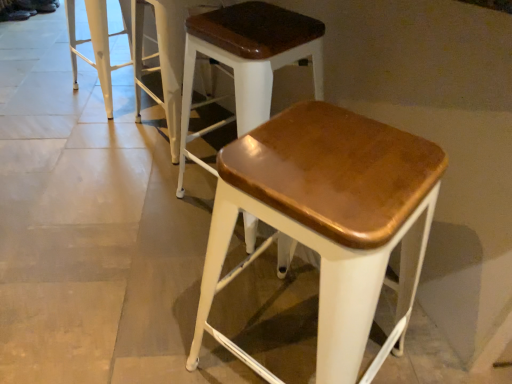
The image size is (512, 384). In order to click on white metal stool at upper left, which is the first stool in left-to-right order in this screenshot , I will do `click(98, 43)`.

This screenshot has width=512, height=384. What do you see at coordinates (98, 43) in the screenshot?
I see `white metal stool at upper left, which is the first stool in left-to-right order` at bounding box center [98, 43].

Locate an element on the screen. matte brown wood stool at center, the 3th stool positioned from the left is located at coordinates (248, 61).

Identify the location of matte brown wood stool at center, marked as the 1th stool in a right-to-left arrangement. This screenshot has width=512, height=384. (329, 221).

Identify the location of the 3rd stool above the white metal stool at upper left, which is counted as the 4th stool, starting from the right (from a real-world perspective). (329, 221).

Does matte brown wood stool at center, which ranks as the 4th stool in left-to-right order, have a lesser height compared to white metal stool at upper left, which is the first stool in left-to-right order?

No.

Considering their positions, is matte brown wood stool at center, marked as the 1th stool in a right-to-left arrangement, located in front of or behind white metal stool at upper left, which is the first stool in left-to-right order?

matte brown wood stool at center, marked as the 1th stool in a right-to-left arrangement, is positioned closer to the viewer than white metal stool at upper left, which is the first stool in left-to-right order.

Is matte brown wood stool at center, marked as the 1th stool in a right-to-left arrangement, with white metal stool at upper left, which is the first stool in left-to-right order?

No, matte brown wood stool at center, marked as the 1th stool in a right-to-left arrangement, is not in contact with white metal stool at upper left, which is the first stool in left-to-right order.

Who is smaller, white metal stool at upper left, which is counted as the 4th stool, starting from the right, or wooden seat stool at center, the second stool in the left-to-right sequence?

white metal stool at upper left, which is counted as the 4th stool, starting from the right.

Would you say white metal stool at upper left, which is the first stool in left-to-right order, is to the left or to the right of wooden seat stool at center, the third stool from the right, in the picture?

From the image, it's evident that white metal stool at upper left, which is the first stool in left-to-right order, is to the left of wooden seat stool at center, the third stool from the right.

Who is taller, white metal stool at upper left, which is counted as the 4th stool, starting from the right, or wooden seat stool at center, the second stool in the left-to-right sequence?

wooden seat stool at center, the second stool in the left-to-right sequence, is taller.

From the image's perspective, is white metal stool at upper left, which is counted as the 4th stool, starting from the right, above or below wooden seat stool at center, the third stool from the right?

white metal stool at upper left, which is counted as the 4th stool, starting from the right, is above wooden seat stool at center, the third stool from the right.

Which object is positioned more to the left, wooden seat stool at center, the second stool in the left-to-right sequence, or white metal stool at upper left, which is counted as the 4th stool, starting from the right?

white metal stool at upper left, which is counted as the 4th stool, starting from the right.

Who is shorter, wooden seat stool at center, the third stool from the right, or white metal stool at upper left, which is the first stool in left-to-right order?

white metal stool at upper left, which is the first stool in left-to-right order, is shorter.

Is point (142, 16) closer or farther from the camera than point (158, 69)?

Point (142, 16).

Would you consider wooden seat stool at center, the third stool from the right, to be distant from white metal stool at upper left, which is counted as the 4th stool, starting from the right?

That's not correct — wooden seat stool at center, the third stool from the right, is a little close to white metal stool at upper left, which is counted as the 4th stool, starting from the right.

Based on the photo, can you confirm if matte brown wood stool at center, the 3th stool positioned from the left, is wider than white metal stool at upper left, which is the first stool in left-to-right order?

Yes.

Is point (259, 61) positioned before point (128, 35)?

Yes, it is.

Is matte brown wood stool at center, which ranks as the second stool in right-to-left order, bigger than white metal stool at upper left, which is counted as the 4th stool, starting from the right?

Yes, matte brown wood stool at center, which ranks as the second stool in right-to-left order, is bigger than white metal stool at upper left, which is counted as the 4th stool, starting from the right.

Does matte brown wood stool at center, the 3th stool positioned from the left, come behind white metal stool at upper left, which is the first stool in left-to-right order?

That is False.

Is matte brown wood stool at center, which ranks as the second stool in right-to-left order, turned away from matte brown wood stool at center, which ranks as the 4th stool in left-to-right order?

matte brown wood stool at center, which ranks as the second stool in right-to-left order, does not have its back to matte brown wood stool at center, which ranks as the 4th stool in left-to-right order.

Is point (321, 69) behind point (231, 215)?

That is True.

Who is more distant, matte brown wood stool at center, the 3th stool positioned from the left, or matte brown wood stool at center, which ranks as the 4th stool in left-to-right order?

matte brown wood stool at center, the 3th stool positioned from the left, is further from the camera.

Which of these two, white metal stool at upper left, which is the first stool in left-to-right order, or matte brown wood stool at center, which ranks as the second stool in right-to-left order, stands shorter?

white metal stool at upper left, which is the first stool in left-to-right order.

Is point (104, 20) farther from viewer compared to point (281, 17)?

Yes, point (104, 20) is behind point (281, 17).

Consider the image. Which object is positioned more to the left, wooden seat stool at center, the third stool from the right, or matte brown wood stool at center, marked as the 1th stool in a right-to-left arrangement?

wooden seat stool at center, the third stool from the right.

Would you say wooden seat stool at center, the second stool in the left-to-right sequence, contains matte brown wood stool at center, which ranks as the 4th stool in left-to-right order?

No, matte brown wood stool at center, which ranks as the 4th stool in left-to-right order, is not inside wooden seat stool at center, the second stool in the left-to-right sequence.

Is point (178, 20) positioned after point (369, 310)?

Yes, it is.

Can you tell me how much wooden seat stool at center, the third stool from the right, and matte brown wood stool at center, marked as the 1th stool in a right-to-left arrangement, differ in facing direction?

There is a 15.5-degree angle between the facing directions of wooden seat stool at center, the third stool from the right, and matte brown wood stool at center, marked as the 1th stool in a right-to-left arrangement.

From the image's perspective, starting from the matte brown wood stool at center, marked as the 1th stool in a right-to-left arrangement, which stool is the 3rd one above? Please provide its 2D coordinates.

[(98, 43)]

Identify the location of stool that is the 1st object above the white metal stool at upper left, which is the first stool in left-to-right order (from a real-world perspective). (165, 57).

Which object lies further to the anchor point white metal stool at upper left, which is counted as the 4th stool, starting from the right, wooden seat stool at center, the second stool in the left-to-right sequence, or matte brown wood stool at center, marked as the 1th stool in a right-to-left arrangement?

matte brown wood stool at center, marked as the 1th stool in a right-to-left arrangement, is further to white metal stool at upper left, which is counted as the 4th stool, starting from the right.

Considering their positions, is matte brown wood stool at center, which ranks as the second stool in right-to-left order, positioned closer to wooden seat stool at center, the second stool in the left-to-right sequence, than white metal stool at upper left, which is the first stool in left-to-right order?

white metal stool at upper left, which is the first stool in left-to-right order.

Considering their positions, is matte brown wood stool at center, marked as the 1th stool in a right-to-left arrangement, positioned further to wooden seat stool at center, the second stool in the left-to-right sequence, than matte brown wood stool at center, which ranks as the second stool in right-to-left order?

Based on the image, matte brown wood stool at center, marked as the 1th stool in a right-to-left arrangement, appears to be further to wooden seat stool at center, the second stool in the left-to-right sequence.

Looking at the image, which one is located closer to matte brown wood stool at center, which ranks as the 4th stool in left-to-right order, matte brown wood stool at center, which ranks as the second stool in right-to-left order, or white metal stool at upper left, which is counted as the 4th stool, starting from the right?

Among the two, matte brown wood stool at center, which ranks as the second stool in right-to-left order, is located nearer to matte brown wood stool at center, which ranks as the 4th stool in left-to-right order.

Estimate the real-world distances between objects in this image. Which object is closer to wooden seat stool at center, the third stool from the right, matte brown wood stool at center, the 3th stool positioned from the left, or matte brown wood stool at center, marked as the 1th stool in a right-to-left arrangement?

matte brown wood stool at center, the 3th stool positioned from the left, is closer to wooden seat stool at center, the third stool from the right.

Considering their positions, is white metal stool at upper left, which is counted as the 4th stool, starting from the right, positioned closer to matte brown wood stool at center, which ranks as the second stool in right-to-left order, than wooden seat stool at center, the second stool in the left-to-right sequence?

Based on the image, wooden seat stool at center, the second stool in the left-to-right sequence, appears to be nearer to matte brown wood stool at center, which ranks as the second stool in right-to-left order.

When comparing their distances from matte brown wood stool at center, marked as the 1th stool in a right-to-left arrangement, does matte brown wood stool at center, which ranks as the second stool in right-to-left order, or wooden seat stool at center, the third stool from the right, seem further?

Based on the image, wooden seat stool at center, the third stool from the right, appears to be further to matte brown wood stool at center, marked as the 1th stool in a right-to-left arrangement.

Estimate the real-world distances between objects in this image. Which object is closer to wooden seat stool at center, the second stool in the left-to-right sequence, white metal stool at upper left, which is counted as the 4th stool, starting from the right, or matte brown wood stool at center, which ranks as the 4th stool in left-to-right order?

white metal stool at upper left, which is counted as the 4th stool, starting from the right, lies closer to wooden seat stool at center, the second stool in the left-to-right sequence, than the other object.

At what (x,y) coordinates should I click in order to perform the action: click on stool between matte brown wood stool at center, marked as the 1th stool in a right-to-left arrangement, and wooden seat stool at center, the third stool from the right, from front to back. Please return your answer as a coordinate pair (x, y). Image resolution: width=512 pixels, height=384 pixels. Looking at the image, I should click on (248, 61).

I want to click on stool between matte brown wood stool at center, which ranks as the second stool in right-to-left order, and white metal stool at upper left, which is the first stool in left-to-right order, from front to back, so click(x=165, y=57).